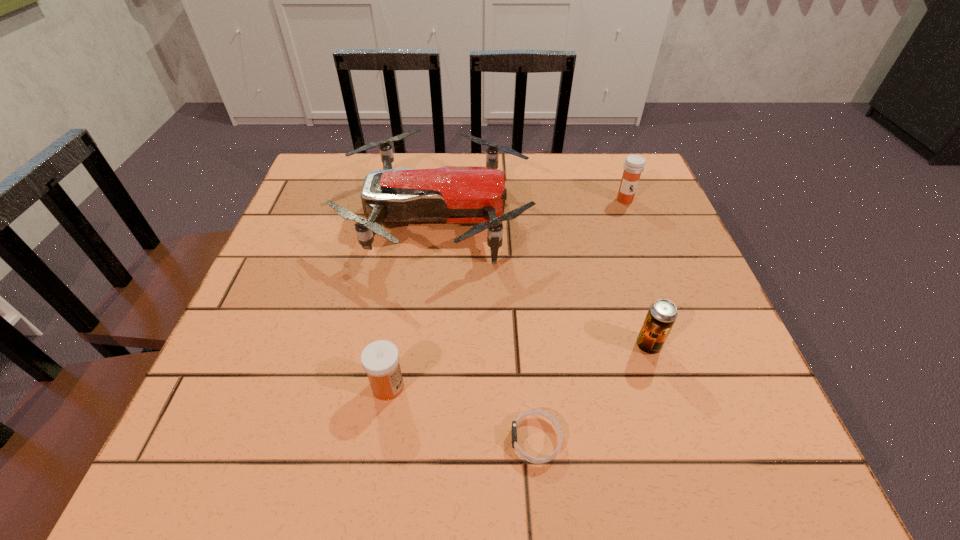
This screenshot has width=960, height=540. Find the location of `medicine that is at the right edge`. medicine that is at the right edge is located at coordinates (634, 165).

Find the location of a particular element. beer can present at the right edge is located at coordinates (662, 314).

At what (x,y) coordinates should I click in order to perform the action: click on object that is at the far left corner. Please return your answer as a coordinate pair (x, y). This screenshot has width=960, height=540. Looking at the image, I should click on (453, 194).

In order to click on object present at the far right corner in this screenshot , I will do `click(634, 165)`.

Find the location of a particular element. The image size is (960, 540). vacant area at the near edge is located at coordinates (493, 456).

Locate an element on the screen. This screenshot has height=540, width=960. vacant space at the left edge of the desktop is located at coordinates (282, 254).

In order to click on vacant space at the right edge in this screenshot , I will do `click(620, 213)`.

Identify the location of vacant space at the far left corner. (347, 197).

You are a GUI agent. You are given a task and a screenshot of the screen. Output one action in this format:
    pyautogui.click(x=<x>, y=<y>)
    Task: Click on the free space at the near left corner of the desktop
    
    Given the screenshot: What is the action you would take?
    pyautogui.click(x=232, y=450)

Find the location of a particular element. The width and height of the screenshot is (960, 540). free point at the far right corner is located at coordinates (616, 165).